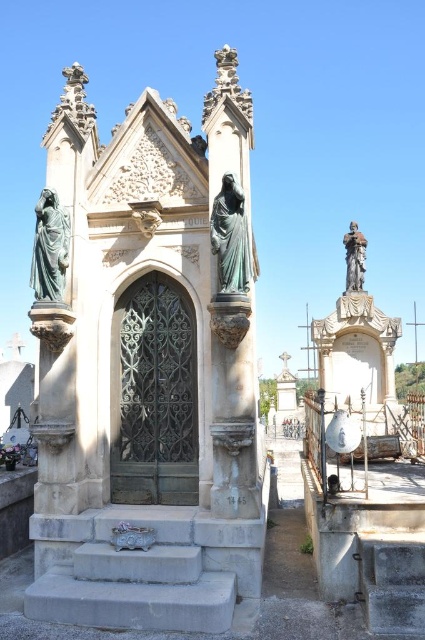
You are standing at the entrance of the mausoleum and want to go to the gray concrete stair at lower right. Which direction should you walk to avoid the green patina stone statue at center?

You should walk to the right side to avoid the green patina stone statue at center, as the gray concrete stair at lower right is located to the right of the statue.

From the picture: You are a visitor at the cemetery and want to take a photo of the gray concrete stair at lower right and the bronze statue at upper right. Since you want both objects to appear clearly in the photo, which object should you focus on to ensure it is not cut off due to its width?

The bronze statue at upper right has a greater width than the gray concrete stair at lower right, so you should focus on the bronze statue at upper right to ensure it is not cut off.